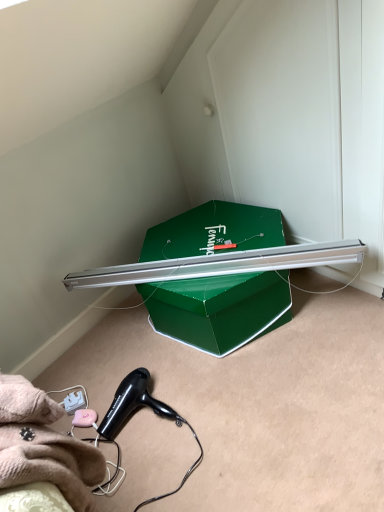
Where is `free space that is in between black plastic hair dryer at lower left and green cardboard box at center`? Image resolution: width=384 pixels, height=512 pixels. free space that is in between black plastic hair dryer at lower left and green cardboard box at center is located at coordinates (168, 367).